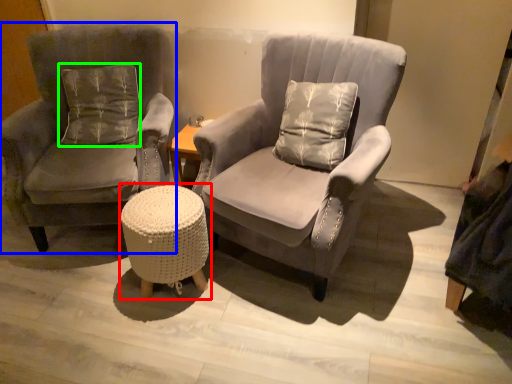
Question: Based on their relative distances, which object is farther from music stool (highlighted by a red box)? Choose from chair (highlighted by a blue box) and pillow (highlighted by a green box).

Choices:
 (A) chair
 (B) pillow

Answer: (B)